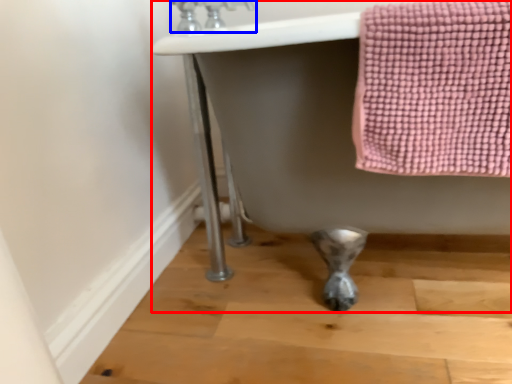
Question: Which object is further to the camera taking this photo, bath (highlighted by a red box) or faucet (highlighted by a blue box)?

Choices:
 (A) bath
 (B) faucet

Answer: (B)